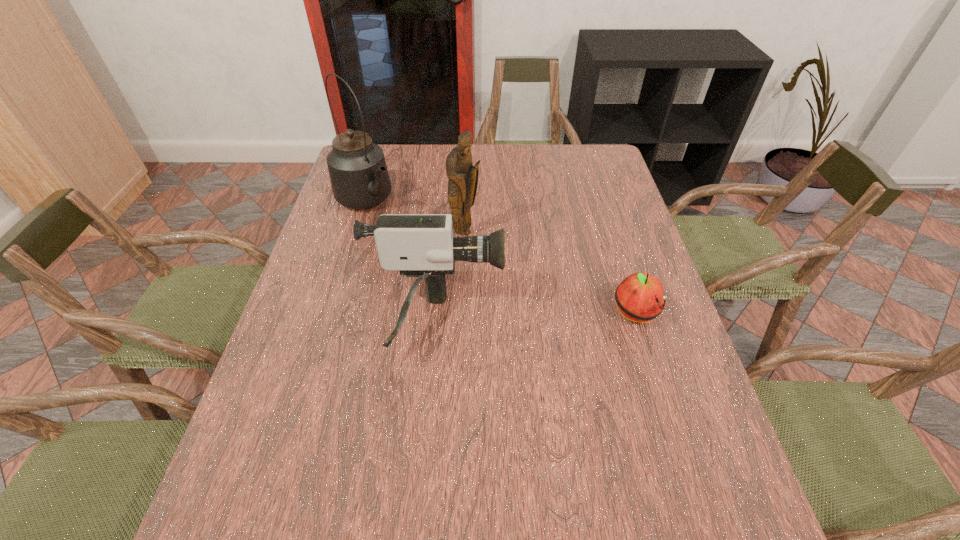
I want to click on free space between the figurine and the camcorder, so click(x=450, y=277).

Locate which object ranks in proximity to the figurine. Please provide its 2D coordinates. Your answer should be formatted as a tuple, i.e. [(x, y)], where the tuple contains the x and y coordinates of a point satisfying the conditions above.

[(358, 172)]

Choose which object is the second nearest neighbor to the camcorder. Please provide its 2D coordinates. Your answer should be formatted as a tuple, i.e. [(x, y)], where the tuple contains the x and y coordinates of a point satisfying the conditions above.

[(358, 172)]

Locate an element on the screen. The width and height of the screenshot is (960, 540). free space that satisfies the following two spatial constraints: 1. on the front side of the kettle; 2. on the right side of the third nearest object is located at coordinates (357, 233).

Find the location of a particular element. This screenshot has height=540, width=960. vacant space that satisfies the following two spatial constraints: 1. on the front side of the tallest object; 2. on the surface of the shortest object is located at coordinates (333, 314).

The width and height of the screenshot is (960, 540). I want to click on vacant region that satisfies the following two spatial constraints: 1. on the front side of the third nearest object; 2. on the left side of the tallest object, so click(357, 233).

The image size is (960, 540). I want to click on free spot that satisfies the following two spatial constraints: 1. on the front side of the third tallest object; 2. on the recording direction of the farthest object, so click(x=331, y=322).

The height and width of the screenshot is (540, 960). What are the coordinates of `free spot that satisfies the following two spatial constraints: 1. on the front side of the kettle; 2. on the surface of the shortest object` in the screenshot? It's located at (333, 314).